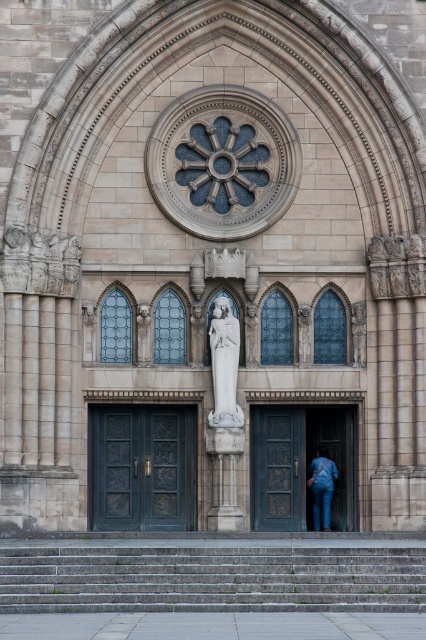
You are a visitor approaching the grand cathedral facade. You see the gray concrete stairs at lower center and the dark wood door at center. Which object is closer to the ground?

The gray concrete stairs at lower center is closer to the ground since it is positioned below the dark wood door at center.

You are standing at the base of the gray concrete stairs at lower center. Looking up at the building, which major architectural feature would be directly above you?

The gray concrete stairs at lower center are positioned at point (210,579), so the major architectural feature directly above them would be the central rose window.

You are standing at the base of the grand building and want to approach the white marble statue at center. Which direction should you move from the gray concrete stairs at lower center to reach it?

The gray concrete stairs at lower center are positioned to the left of the white marble statue at center, so you should move to the right from the stairs to reach the statue.